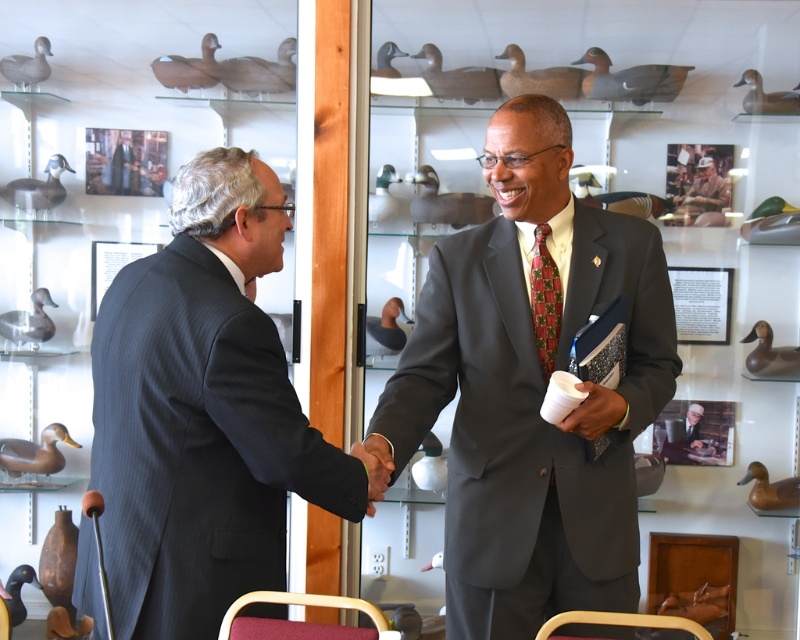
Question: Does white matte cup at center appear on the left side of white hard hat at upper center?

Choices:
 (A) yes
 (B) no

Answer: (A)

Question: Which point is farther from the camera taking this photo?

Choices:
 (A) (538, 328)
 (B) (290, 408)
 (C) (720, 438)

Answer: (C)

Question: Does dark gray suit at center appear on the left side of white hard hat at upper center?

Choices:
 (A) no
 (B) yes

Answer: (B)

Question: In this image, where is dark gray suit at center located relative to white matte cup at center?

Choices:
 (A) right
 (B) left

Answer: (B)

Question: Which of these objects is positioned farthest from the matte gray suit at center?

Choices:
 (A) white matte cup at center
 (B) smooth wooden frame at center
 (C) dark gray suit at center
 (D) red plaid tie at center

Answer: (B)

Question: Among these objects, which one is nearest to the camera?

Choices:
 (A) white matte cup at center
 (B) smooth wooden frame at center
 (C) red plaid tie at center

Answer: (A)